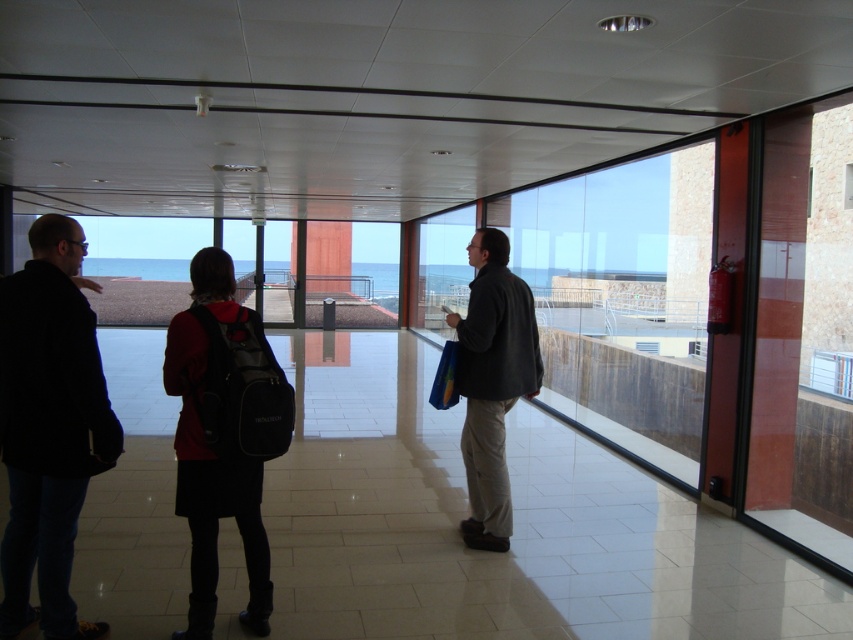
Who is higher up, dark gray fabric jacket at center or clear glass window at center?

dark gray fabric jacket at center is higher up.

Who is taller, dark gray fabric jacket at center or clear glass window at center?

dark gray fabric jacket at center is taller.

You are a GUI agent. You are given a task and a screenshot of the screen. Output one action in this format:
    pyautogui.click(x=<x>, y=<y>)
    Task: Click on the dark gray fabric jacket at center
    
    Given the screenshot: What is the action you would take?
    pyautogui.click(x=492, y=381)

Who is positioned more to the left, matte black backpack at center or clear glass window at center?

matte black backpack at center

Is matte black backpack at center bigger than clear glass window at center?

Incorrect, matte black backpack at center is not larger than clear glass window at center.

The image size is (853, 640). Describe the element at coordinates (216, 440) in the screenshot. I see `matte black backpack at center` at that location.

Locate an element on the screen. The image size is (853, 640). matte black backpack at center is located at coordinates (216, 440).

Is point (38, 616) less distant than point (254, 452)?

That is False.

Does dark gray jacket at left have a smaller size compared to matte black backpack at center?

No.

Identify the location of dark gray jacket at left. (49, 426).